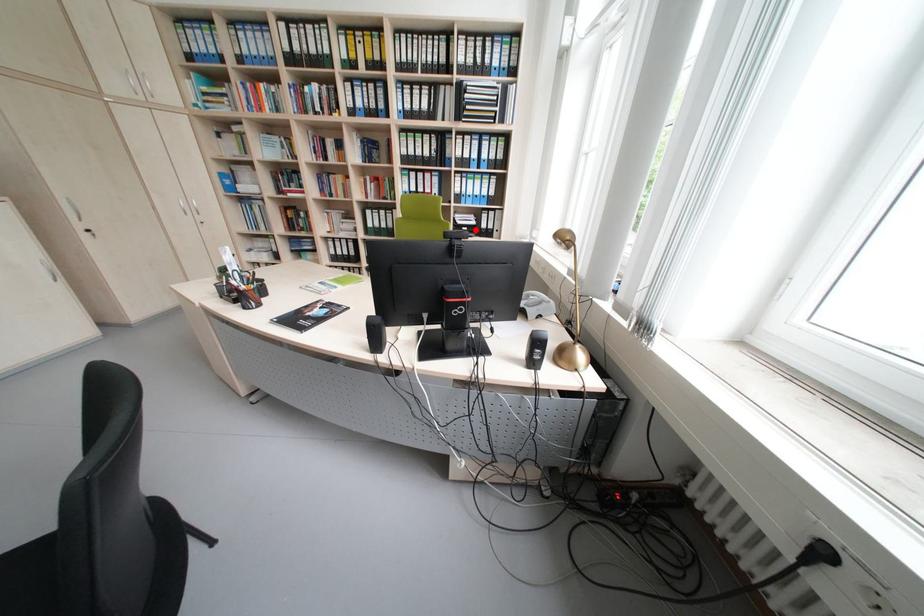
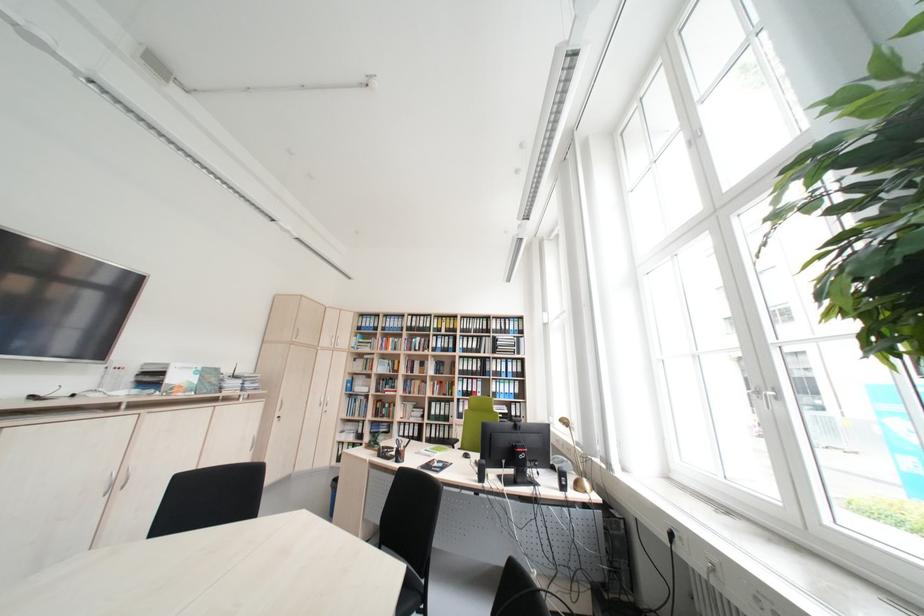
Question: I am providing you with two images of the same scene from different viewpoints. A red point is marked on the first image. Is the red point's position out of view in image 2?

Choices:
 (A) Yes
 (B) No

Answer: (A)